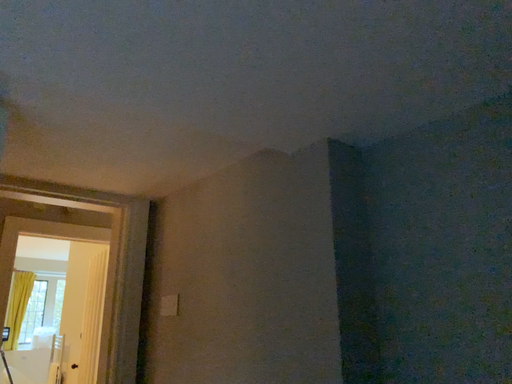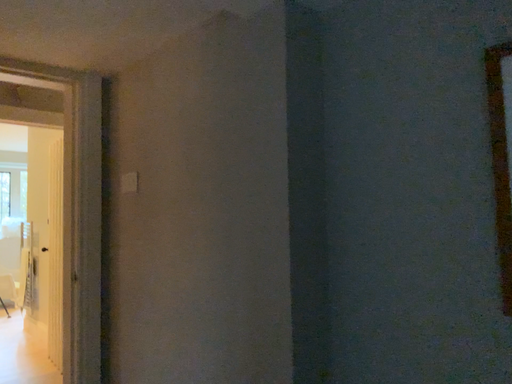
Question: Which way did the camera rotate in the video?

Choices:
 (A) rotated downward
 (B) rotated upward

Answer: (A)